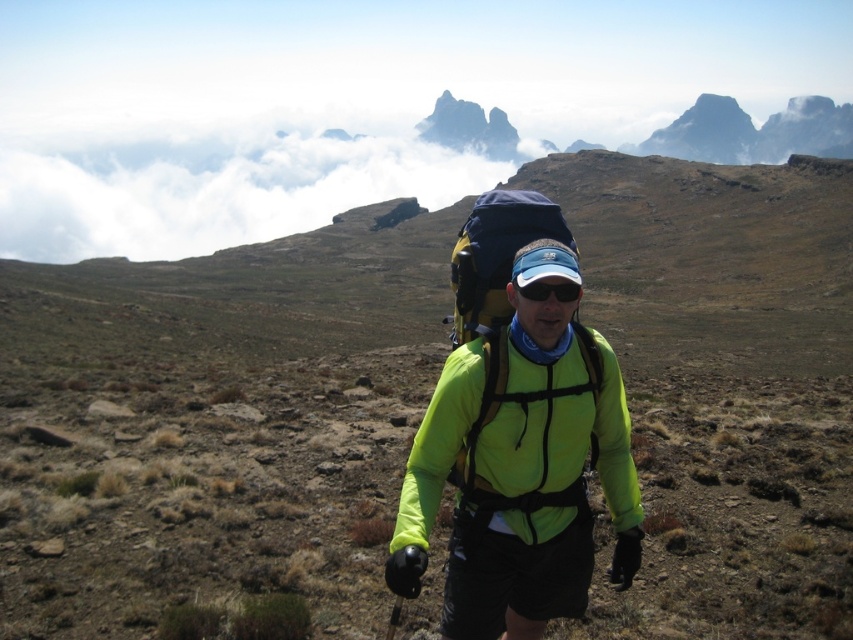
Question: Based on their relative distances, which object is nearer to the neon green fabric jacket at center?

Choices:
 (A) black matte goggles at center
 (B) white fluffy cloud at upper center

Answer: (A)

Question: Can you confirm if neon green fabric jacket at center is smaller than navy blue fabric backpack at center?

Choices:
 (A) no
 (B) yes

Answer: (B)

Question: In this image, where is neon green fabric jacket at center located relative to white fluffy cloud at upper center?

Choices:
 (A) above
 (B) below

Answer: (B)

Question: Based on their relative distances, which object is nearer to the white fluffy cloud at upper center?

Choices:
 (A) navy blue fabric backpack at center
 (B) neon green fabric jacket at center

Answer: (A)

Question: Is neon green fabric jacket at center closer to the viewer compared to navy blue fabric backpack at center?

Choices:
 (A) yes
 (B) no

Answer: (A)

Question: Among these points, which one is farthest from the camera?

Choices:
 (A) (519, 484)
 (B) (480, 253)
 (C) (540, 300)

Answer: (B)